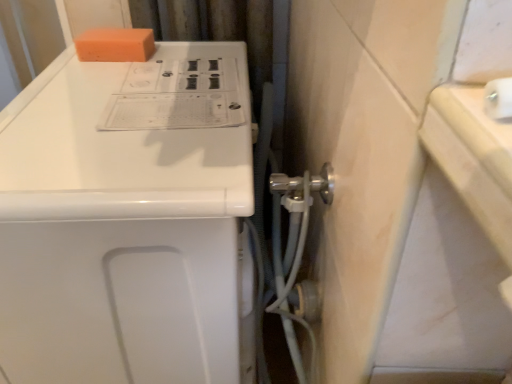
Locate an element on the screen. The width and height of the screenshot is (512, 384). vacant area that is in front of orange sponge at upper left is located at coordinates (102, 79).